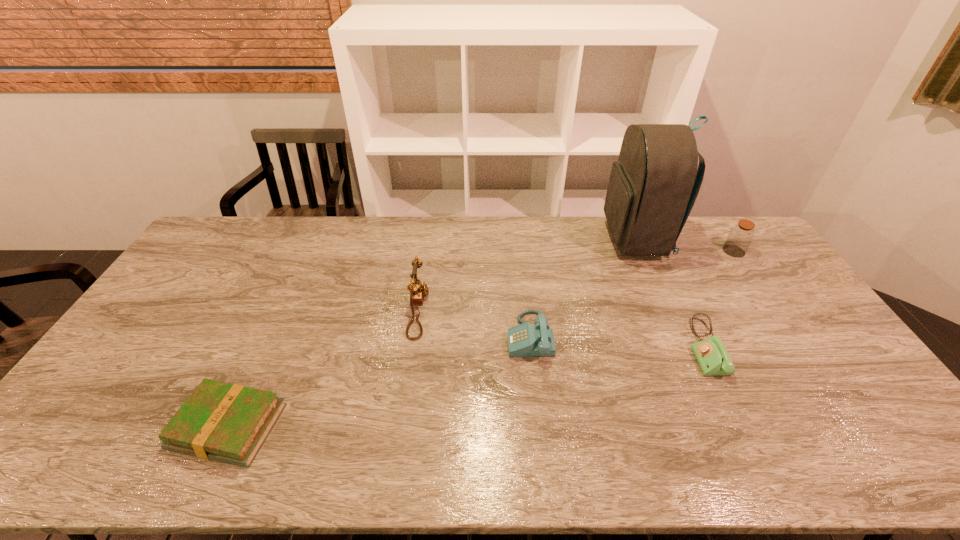
Where is `vacant region between the jar and the leftmost telephone`? vacant region between the jar and the leftmost telephone is located at coordinates point(576,280).

Where is `free space that is in between the rightmost object and the backpack`? This screenshot has height=540, width=960. free space that is in between the rightmost object and the backpack is located at coordinates [685, 245].

Locate an element on the screen. The width and height of the screenshot is (960, 540). vacant area between the jar and the third shortest object is located at coordinates (632, 294).

This screenshot has height=540, width=960. In order to click on free space between the second shortest telephone and the jar in this screenshot , I will do `click(632, 294)`.

Identify the location of vacant area that lies between the leftmost telephone and the second shortest telephone. (474, 322).

This screenshot has width=960, height=540. I want to click on free spot between the tallest object and the nearest object, so click(x=432, y=333).

The image size is (960, 540). I want to click on free space between the tallest object and the leftmost object, so point(432,333).

The height and width of the screenshot is (540, 960). In order to click on vacant space in between the rightmost object and the fourth tallest object in this screenshot , I will do `click(632, 294)`.

Image resolution: width=960 pixels, height=540 pixels. Identify the location of vacant point located between the jar and the backpack. (685, 245).

The height and width of the screenshot is (540, 960). Identify the location of object that is the fourth closest one to the second telephone from left to right. (220, 421).